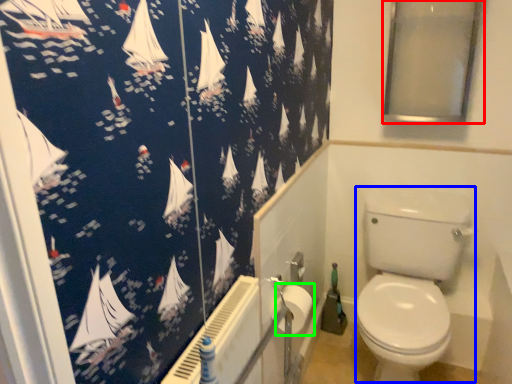
Question: Based on their relative distances, which object is farther from window screen (highlighted by a red box)? Choose from toilet bowl (highlighted by a blue box) and toilet paper (highlighted by a green box).

Choices:
 (A) toilet bowl
 (B) toilet paper

Answer: (B)